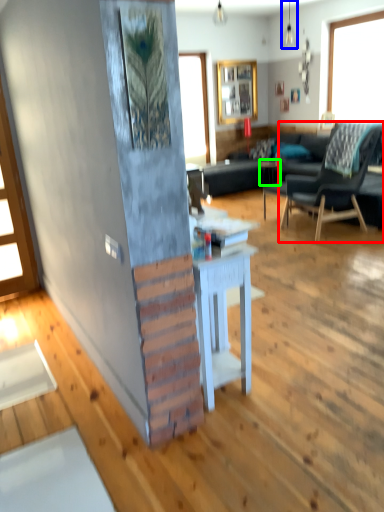
Question: Estimate the real-world distances between objects in this image. Which object is farther from chair (highlighted by a red box), lamp (highlighted by a blue box) or side table (highlighted by a green box)?

Choices:
 (A) lamp
 (B) side table

Answer: (A)